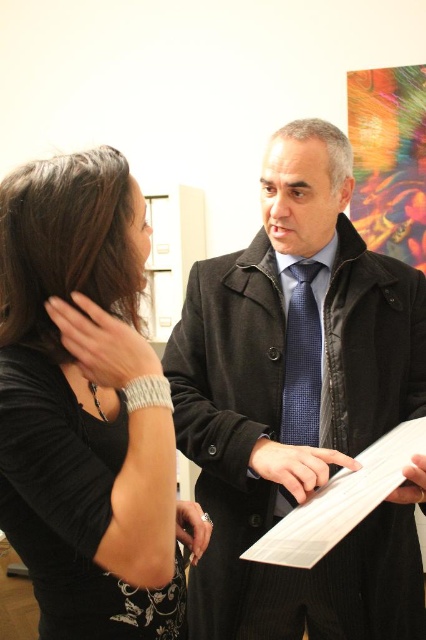
You are standing at the entrance of the art gallery and see two points marked in the scene. The first point is at coordinate point (199, 596) and the second is at point (313, 337). Which point is closer to you?

Point (199, 596) is in front of point (313, 337), so it is closer to you.

You are standing in an art gallery and see a man in a dark coat and a woman at point [109,532]. The man wants to hand the woman a small brochure. Can he reach her without moving closer? The brochure is 3 inches long.

The distance between the man and the woman at point [109,532] is 25.68 inches. Since the brochure is only 3 inches long, the man cannot reach her without moving closer because the distance is greater than the brochure length.

You are standing in the art gallery and see two points marked in the image. Which point is closer to you, point (273, 252) or point (135, 532)?

Point (273, 252) is further to the viewer than point (135, 532), so point (135, 532) is closer to you.